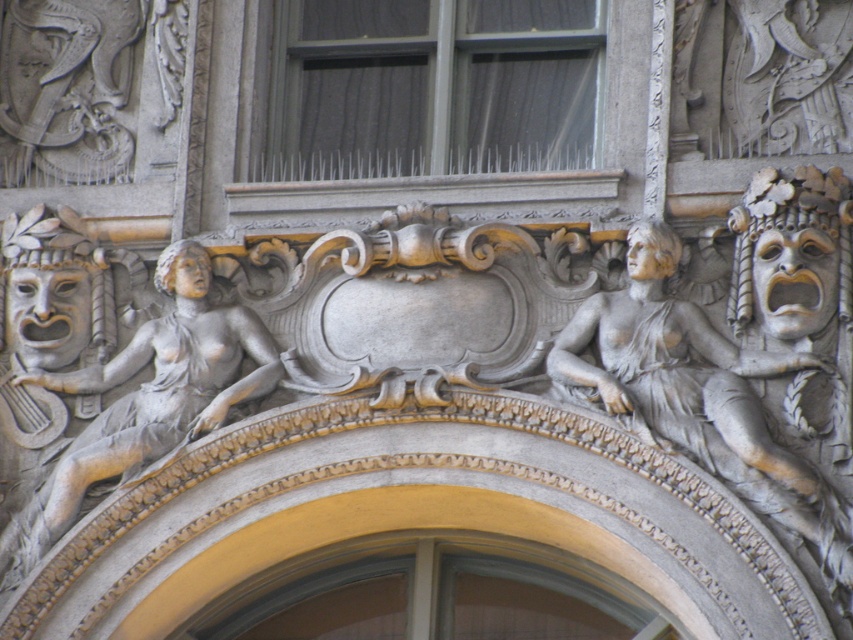
You are an art conservator examining the intricate carvings on a historical building facade. You notice two gray stone figures in the scene. The first is the gray stone female figure at right, and the second is the gray stone woman at center. Based on their physical characteristics, which of these two figures is narrower in width?

The gray stone female figure at right is thinner than the gray stone woman at center, so the gray stone female figure at right is narrower in width.

Consider the image. You are an architect analyzing this historical facade. You notice two points marked on the carving details. The first point is at coordinates point (677, 392) and the second is at point (198, 328). Based on the spatial relationship between them, which point is closer to the viewer?

Point (677, 392) is in front of point (198, 328), so it is closer to the viewer.